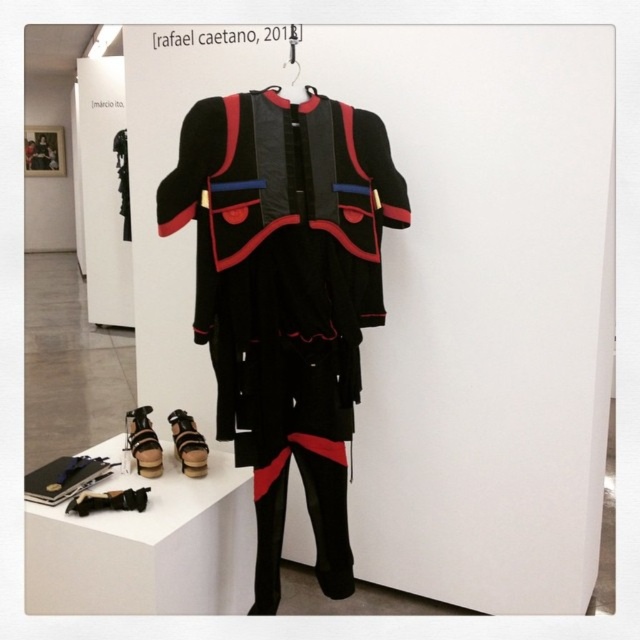
You are a photographer standing 2 meters away from the leather sandal at lower center. Can you reach the camera without moving your feet?

The leather sandal at lower center and camera are 1.92 meters apart. Since you are standing 2 meters away from the leather sandal at lower center, the camera is within your reach if you can extend your arm about 8 centimeters further. However, this depends on your arm length and flexibility.

You are a fashion designer trying to arrange the black smooth pants at lower center and the black leather shoe at lower left on a display stand. If you want to place the taller item on top, which one should you choose?

The black smooth pants at lower center has a greater height compared to the black leather shoe at lower left, so you should place the black smooth pants at lower center on top.

You are standing at the point labeled point (324,449). You want to walk to the entrance of the exhibit, which is located 1.75 meters away from your current position. Is the entrance within a 2 meter radius from your current location?

Yes, the entrance is within a 2 meter radius because the distance between them is 1.75 meters, which is less than 2 meters.